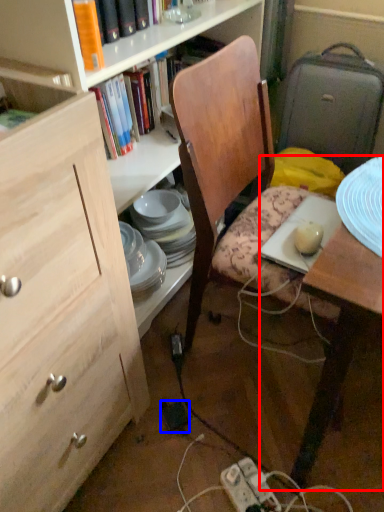
Question: Which of the following is the farthest to the observer, desk (highlighted by a red box) or power plugs and sockets (highlighted by a blue box)?

Choices:
 (A) desk
 (B) power plugs and sockets

Answer: (B)